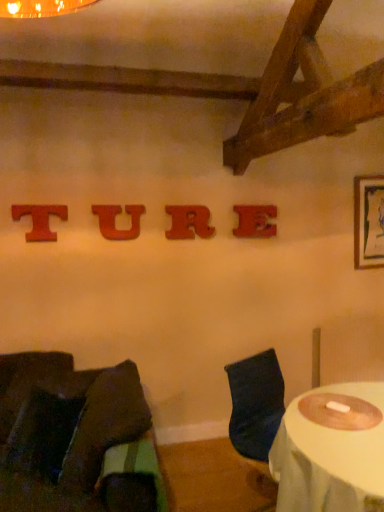
Question: From a real-world perspective, is red wood letter t at upper center, which is counted as the fourth alphabet, starting from the right, positioned under wooden letter e at center, the first alphabet viewed from the right, based on gravity?

Choices:
 (A) yes
 (B) no

Answer: (B)

Question: Is red wood letter t at upper center, which is counted as the fourth alphabet, starting from the right, beside wooden letter e at center, the first alphabet viewed from the right?

Choices:
 (A) yes
 (B) no

Answer: (B)

Question: Is wooden letter e at center, which is the 4th alphabet in left-to-right order, surrounded by red wood letter t at upper center, which is counted as the fourth alphabet, starting from the right?

Choices:
 (A) yes
 (B) no

Answer: (B)

Question: From a real-world perspective, is red wood letter t at upper center, which is the first alphabet from left to right, on wooden letter e at center, the first alphabet viewed from the right?

Choices:
 (A) no
 (B) yes

Answer: (B)

Question: Does red wood letter t at upper center, which is the first alphabet from left to right, appear on the left side of wooden letter e at center, which is the 4th alphabet in left-to-right order?

Choices:
 (A) no
 (B) yes

Answer: (B)

Question: Visually, is velvet dark brown chair at lower left, the second chair from the right, positioned to the left or to the right of red wood letter t at upper center, which is the first alphabet from left to right?

Choices:
 (A) right
 (B) left

Answer: (A)

Question: In terms of width, does velvet dark brown chair at lower left, which ranks as the 1th chair in left-to-right order, look wider or thinner when compared to red wood letter t at upper center, which is counted as the fourth alphabet, starting from the right?

Choices:
 (A) wide
 (B) thin

Answer: (A)

Question: From the image's perspective, is velvet dark brown chair at lower left, which ranks as the 1th chair in left-to-right order, positioned above or below red wood letter t at upper center, which is counted as the fourth alphabet, starting from the right?

Choices:
 (A) above
 (B) below

Answer: (B)

Question: In the image, is velvet dark brown chair at lower left, the second chair from the right, positioned in front of or behind red wood letter t at upper center, which is the first alphabet from left to right?

Choices:
 (A) behind
 (B) front

Answer: (B)

Question: Considering their positions, is white fabric-covered table at lower right located in front of or behind red wood letter t at upper center, which is the first alphabet from left to right?

Choices:
 (A) front
 (B) behind

Answer: (A)

Question: Is white fabric-covered table at lower right to the left or to the right of red wood letter t at upper center, which is the first alphabet from left to right, in the image?

Choices:
 (A) left
 (B) right

Answer: (B)

Question: From a real-world perspective, is white fabric-covered table at lower right above or below red wood letter t at upper center, which is the first alphabet from left to right?

Choices:
 (A) below
 (B) above

Answer: (A)

Question: From the image's perspective, is white fabric-covered table at lower right located above or below red wood letter t at upper center, which is counted as the fourth alphabet, starting from the right?

Choices:
 (A) below
 (B) above

Answer: (A)

Question: Visually, is wooden letter r at center, the 2th alphabet when ordered from right to left, positioned to the left or to the right of wooden letter u at center, which is the 2th alphabet from left to right?

Choices:
 (A) left
 (B) right

Answer: (B)

Question: From a real-world perspective, relative to wooden letter u at center, which is the 2th alphabet from left to right, is wooden letter r at center, which is the third alphabet from left to right, vertically above or below?

Choices:
 (A) above
 (B) below

Answer: (A)